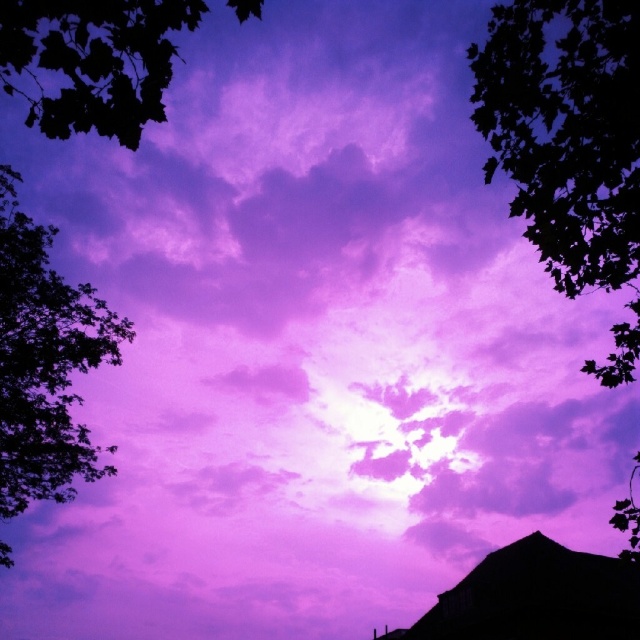
You are a bird flying between the dark green leafy tree at upper right and the dark green leafy tree at left. If your wingspan is 1.2 meters, can you safely fly between them without touching either tree?

The distance between the dark green leafy tree at upper right and the dark green leafy tree at left is 23.54 meters. Since your wingspan is only 1.2 meters, there is more than enough space to fly between them safely without touching either tree.

You are an astronomer analyzing this sky scene. You notice two points in the image, one at coordinates point (x=625, y=106) and another at point (x=58, y=442). Which point is nearer to your viewpoint as you observe the scene?

Point (x=625, y=106) is closer to the camera than point (x=58, y=442), so the point at coordinates point (x=625, y=106) is nearer to your viewpoint.